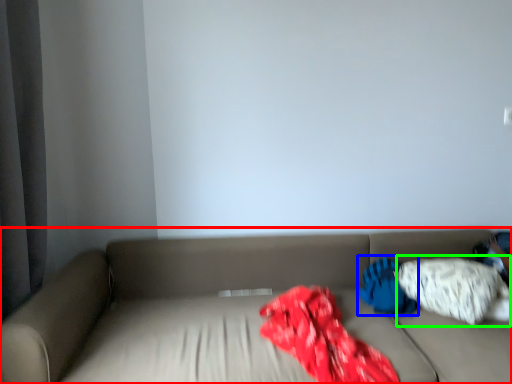
Question: Which object is positioned closest to studio couch (highlighted by a red box)? Select from pillow (highlighted by a blue box) and pillow (highlighted by a green box).

Choices:
 (A) pillow
 (B) pillow

Answer: (B)